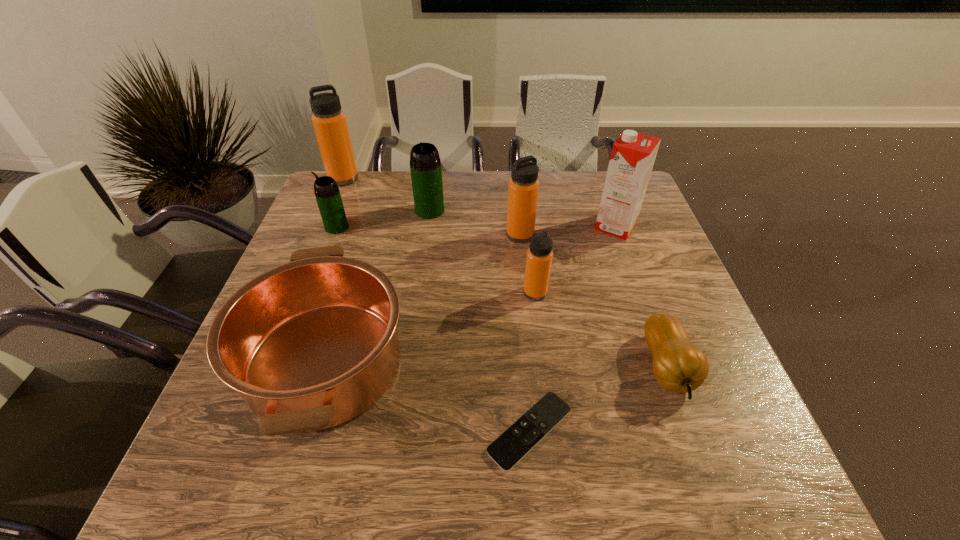
Locate an element on the screen. the seventh tallest object is located at coordinates (311, 344).

Locate an element on the screen. gourd is located at coordinates (680, 367).

Find the location of `black remote control`. black remote control is located at coordinates (510, 447).

Where is `the shortest object`? The width and height of the screenshot is (960, 540). the shortest object is located at coordinates (510, 447).

Identify the location of free space located 0.350m on the front of the biggest orange thermos bottle. (310, 259).

Where is `free space located 0.220m on the front of the carton`? free space located 0.220m on the front of the carton is located at coordinates (641, 298).

Where is `vacant area located 0.130m from the spout of the farther green thermos bottle`? Image resolution: width=960 pixels, height=540 pixels. vacant area located 0.130m from the spout of the farther green thermos bottle is located at coordinates (424, 248).

Locate an element on the screen. free spot located 0.380m on the left of the second farthest orange thermos bottle is located at coordinates (371, 235).

The image size is (960, 540). In order to click on free region located on the back of the nearest orange thermos bottle in this screenshot , I will do `click(527, 227)`.

The image size is (960, 540). Identify the location of vacant region located on the right of the saucepan. (478, 362).